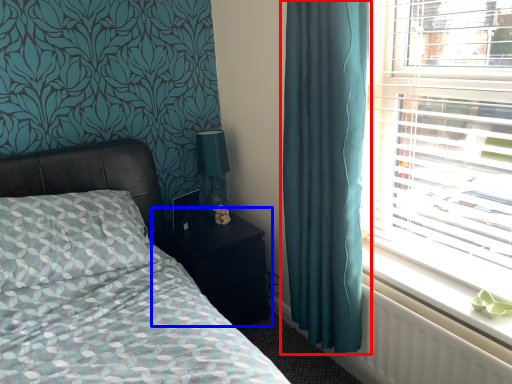
Question: Which object is further to the camera taking this photo, curtain (highlighted by a red box) or nightstand (highlighted by a blue box)?

Choices:
 (A) curtain
 (B) nightstand

Answer: (B)